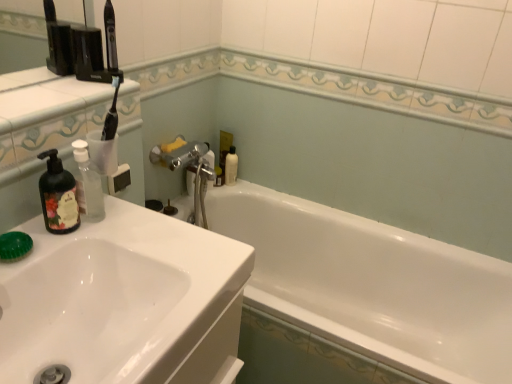
I want to click on free space on the front side of clear plastic bottle at left, so click(x=64, y=241).